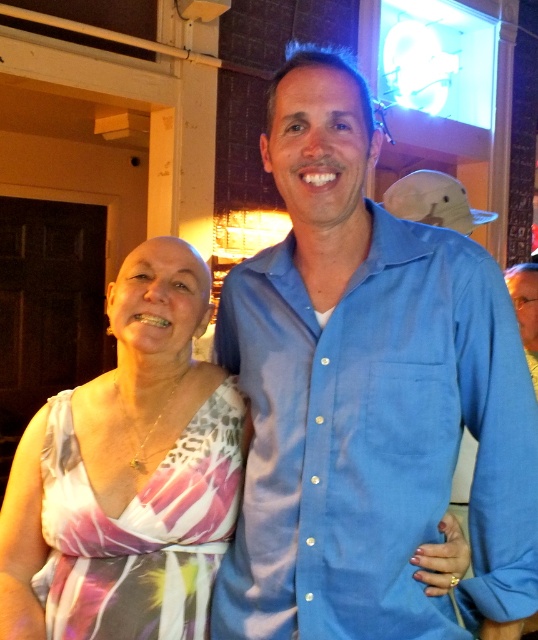
Question: Does blue cotton shirt at center appear on the left side of printed fabric dress at center?

Choices:
 (A) no
 (B) yes

Answer: (A)

Question: Which point appears closest to the camera in this image?

Choices:
 (A) (192, 541)
 (B) (414, 323)

Answer: (B)

Question: Which point is farther from the camera taking this photo?

Choices:
 (A) (281, 250)
 (B) (145, 468)

Answer: (B)

Question: Can you confirm if blue cotton shirt at center is bigger than printed fabric dress at center?

Choices:
 (A) yes
 (B) no

Answer: (A)

Question: Is blue cotton shirt at center further to camera compared to printed fabric dress at center?

Choices:
 (A) yes
 (B) no

Answer: (B)